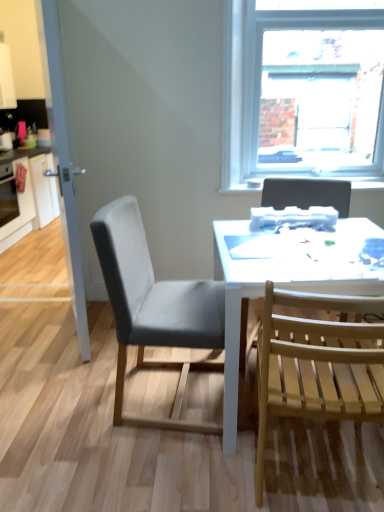
Question: From the image's perspective, would you say light wood slats chair at right, the second chair positioned from the left, is positioned over matte pink coffee cup at left?

Choices:
 (A) no
 (B) yes

Answer: (A)

Question: Does light wood slats chair at right, the second chair positioned from the left, appear on the left side of matte pink coffee cup at left?

Choices:
 (A) no
 (B) yes

Answer: (A)

Question: From the image's perspective, is light wood slats chair at right, the second chair positioned from the left, below matte pink coffee cup at left?

Choices:
 (A) no
 (B) yes

Answer: (B)

Question: Does light wood slats chair at right, which is the 2th chair from right to left, have a smaller size compared to matte pink coffee cup at left?

Choices:
 (A) yes
 (B) no

Answer: (B)

Question: From a real-world perspective, is light wood slats chair at right, the second chair positioned from the left, over matte pink coffee cup at left?

Choices:
 (A) yes
 (B) no

Answer: (B)

Question: Is light wood slats chair at right, the second chair positioned from the left, to the right of matte pink coffee cup at left from the viewer's perspective?

Choices:
 (A) no
 (B) yes

Answer: (B)

Question: Can you confirm if gray fabric chair at center, which is the 3th chair from right to left, is thinner than white glossy cabinet at left?

Choices:
 (A) no
 (B) yes

Answer: (B)

Question: Does gray fabric chair at center, which is the 3th chair from right to left, have a smaller size compared to white glossy cabinet at left?

Choices:
 (A) yes
 (B) no

Answer: (A)

Question: From a real-world perspective, is gray fabric chair at center, marked as the first chair in a left-to-right arrangement, physically above white glossy cabinet at left?

Choices:
 (A) no
 (B) yes

Answer: (B)

Question: Are gray fabric chair at center, which is the 3th chair from right to left, and white glossy cabinet at left making contact?

Choices:
 (A) no
 (B) yes

Answer: (A)

Question: From the image's perspective, is gray fabric chair at center, marked as the first chair in a left-to-right arrangement, on top of white glossy cabinet at left?

Choices:
 (A) no
 (B) yes

Answer: (A)

Question: Is the position of gray fabric chair at center, marked as the first chair in a left-to-right arrangement, more distant than that of white glossy cabinet at left?

Choices:
 (A) no
 (B) yes

Answer: (A)

Question: From the image's perspective, would you say clear glass door at left is shown under brushed metal oven at left?

Choices:
 (A) yes
 (B) no

Answer: (A)